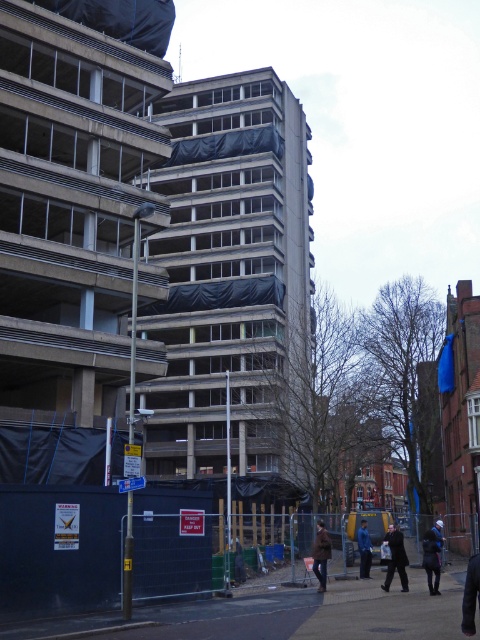
You are standing at the entrance of the construction site and need to reach the brown asphalt pavement at lower center. According to the coordinates provided, where exactly should you head to find it?

The brown asphalt pavement at lower center is located at point (284, 616), so you should head to that coordinate to find it.

You are a delivery person who needs to leave a package at the construction site. You see the brown woolen coat at lower right. Where should you place the package so that it is closest to the coat but still within the fenced area?

Place the package near the brown woolen coat at lower right within the fenced area.

You are a construction worker who just arrived at the site. You see a brown woolen coat at lower right and a dark blue jacket at lower right. Which one is closer to you?

The brown woolen coat at lower right is closer to you because the dark blue jacket at lower right is behind it.